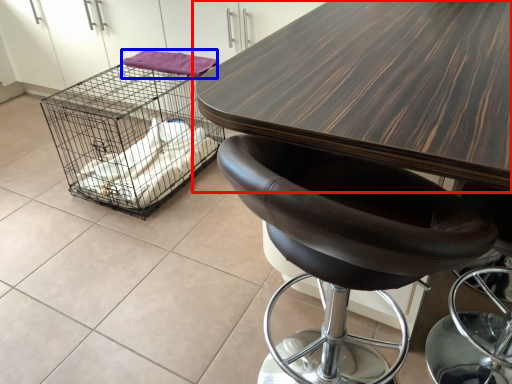
Question: Which object appears closest to the camera in this image, table (highlighted by a red box) or material (highlighted by a blue box)?

Choices:
 (A) table
 (B) material

Answer: (A)